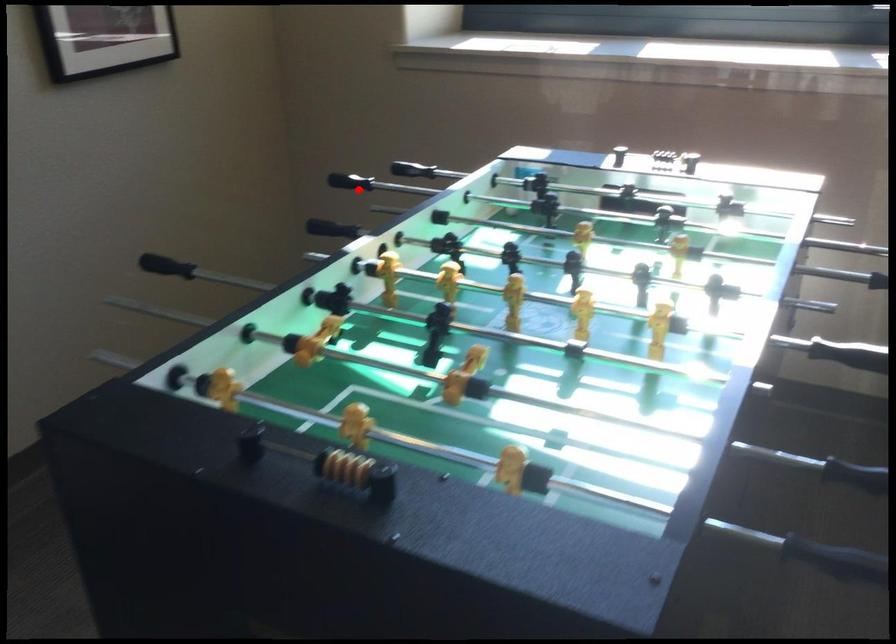
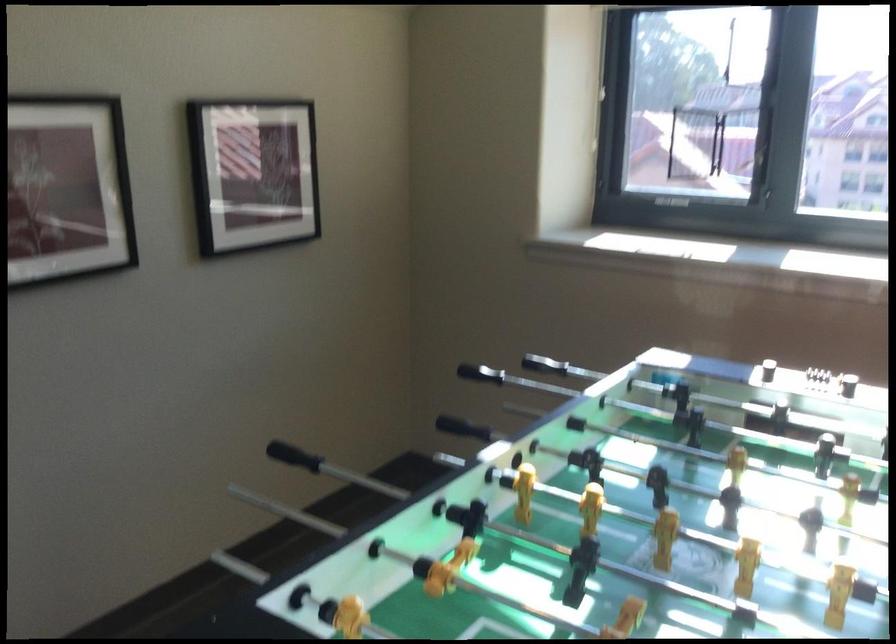
The point at the highlighted location is marked in the first image. Where is the corresponding point in the second image?

(479, 373)